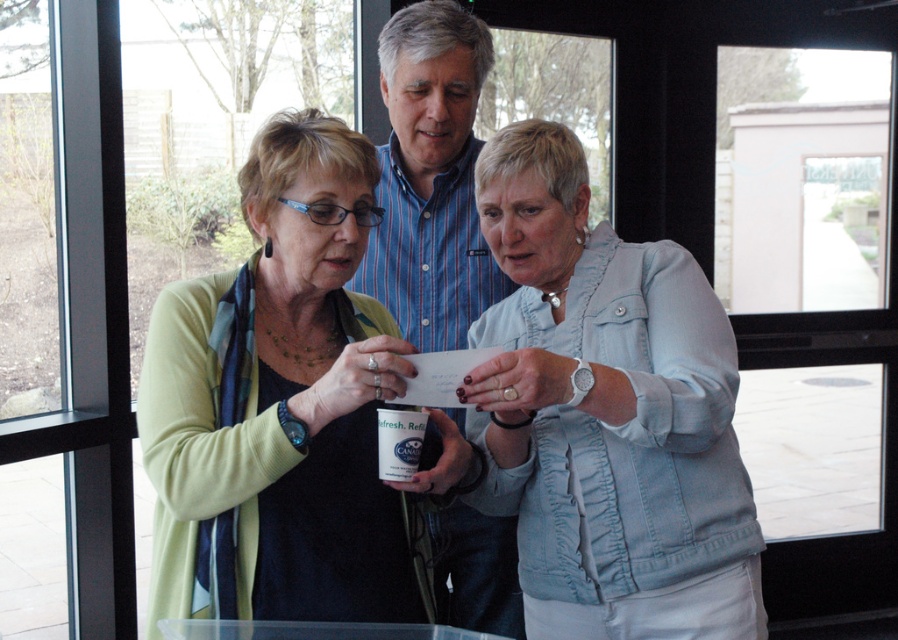
Question: Which of the following is the closest to the observer?

Choices:
 (A) white glossy mug at center
 (B) light blue denim jacket at center
 (C) blue striped shirt at center
 (D) matte green cardigan at center

Answer: (D)

Question: Which point is farther to the camera?

Choices:
 (A) white glossy mug at center
 (B) light blue denim jacket at center

Answer: (B)

Question: Which of these objects is positioned farthest from the light blue denim jacket at center?

Choices:
 (A) blue striped shirt at center
 (B) matte green cardigan at center

Answer: (A)

Question: Does light blue denim jacket at center appear on the left side of blue striped shirt at center?

Choices:
 (A) no
 (B) yes

Answer: (A)

Question: Does white glossy mug at center appear on the left side of light blue denim jacket at center?

Choices:
 (A) no
 (B) yes

Answer: (B)

Question: Does matte green cardigan at center have a lesser width compared to blue striped shirt at center?

Choices:
 (A) no
 (B) yes

Answer: (A)